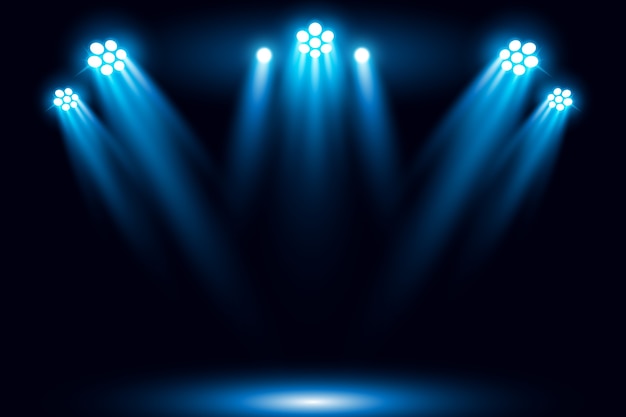
Find the location of a particular element. The image size is (626, 417). spotlights is located at coordinates (64, 100), (101, 60), (260, 55), (310, 37), (364, 50), (521, 55), (562, 97).